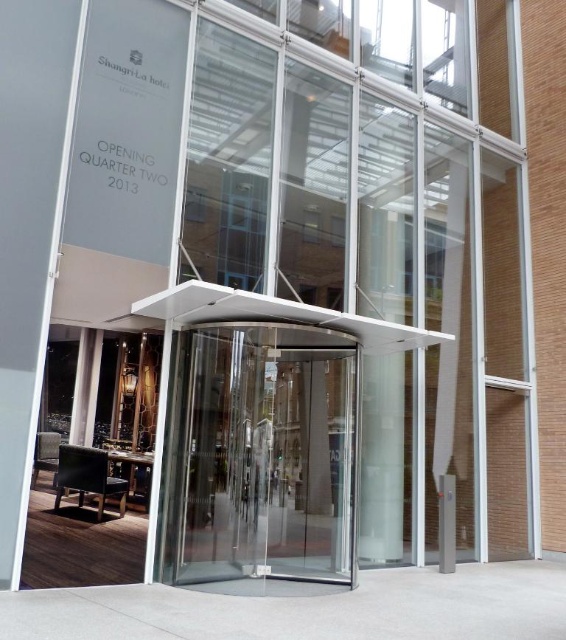
Question: Does transparent glass door at center lie behind smooth concrete pillar at center?

Choices:
 (A) no
 (B) yes

Answer: (A)

Question: Which point is closer to the camera?

Choices:
 (A) transparent glass door at center
 (B) smooth concrete pillar at center

Answer: (A)

Question: Is transparent glass door at center above smooth concrete pillar at center?

Choices:
 (A) yes
 (B) no

Answer: (A)

Question: Which of the following is the closest to the observer?

Choices:
 (A) transparent glass door at center
 (B) smooth concrete pillar at center

Answer: (A)

Question: Can you confirm if transparent glass door at center is wider than smooth concrete pillar at center?

Choices:
 (A) yes
 (B) no

Answer: (A)